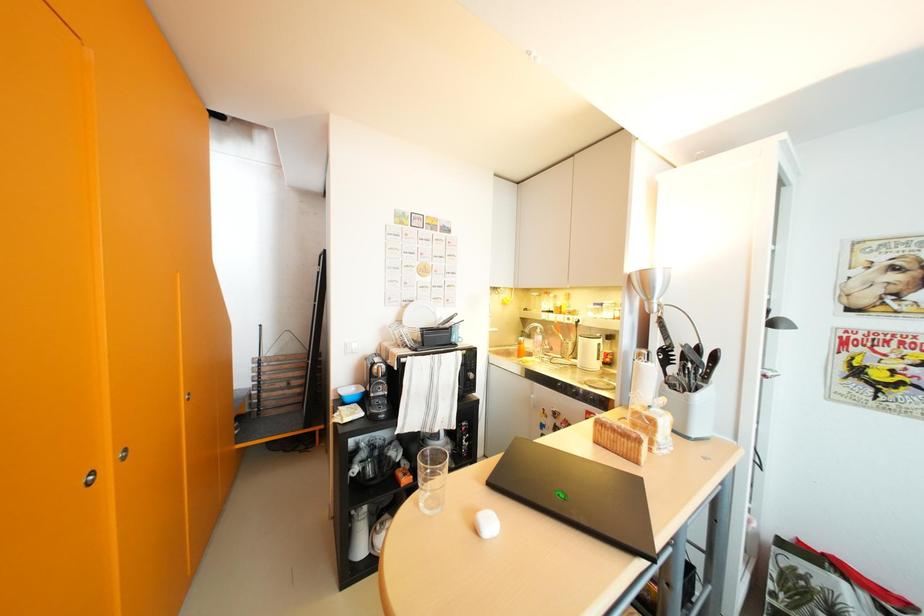
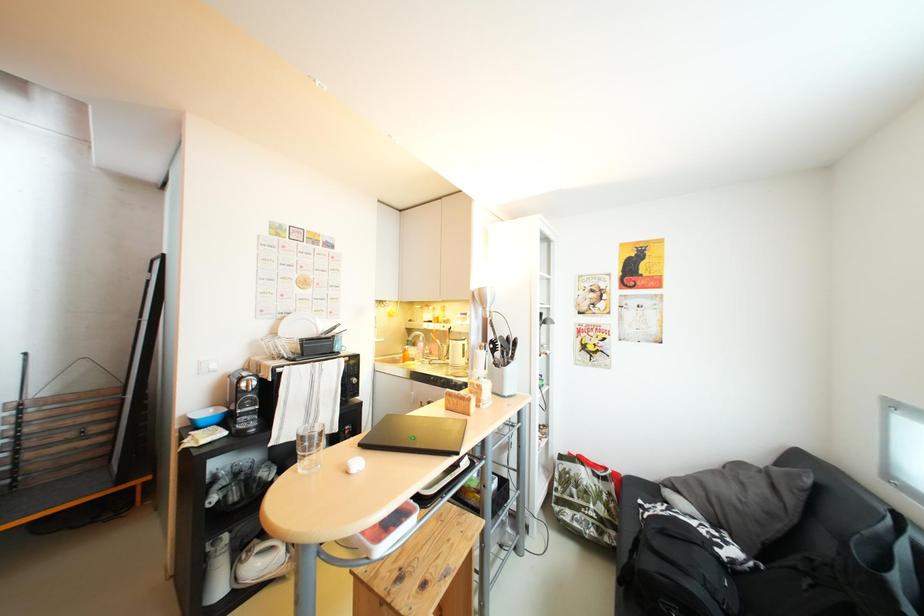
Question: How did the camera likely rotate?

Choices:
 (A) Left
 (B) Right
 (C) Up
 (D) Down

Answer: (B)